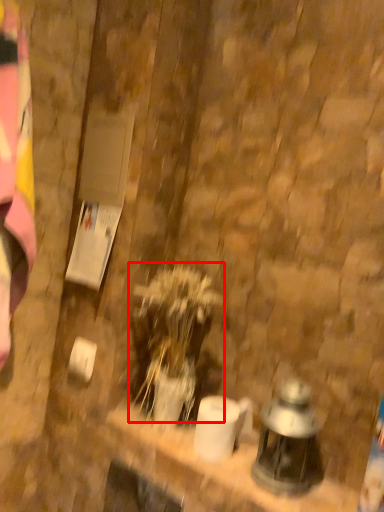
Question: Considering the relative positions of plant (annotated by the red box) and lantern in the image provided, where is plant (annotated by the red box) located with respect to the staircase?

Choices:
 (A) right
 (B) left

Answer: (B)